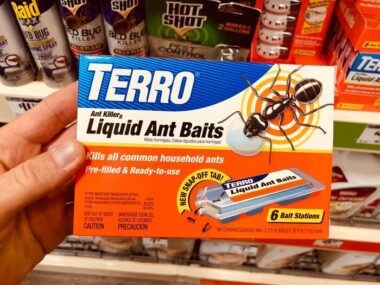
Identify the location of orange shelf front ledge, second shelf. (368, 247).